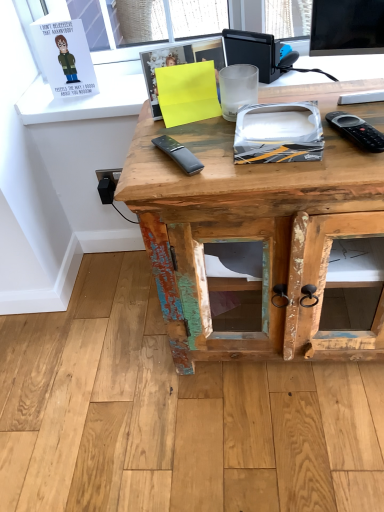
Find the location of `free space above rustic wood desk at center (from a real-world perspective)`. free space above rustic wood desk at center (from a real-world perspective) is located at coordinates (278, 120).